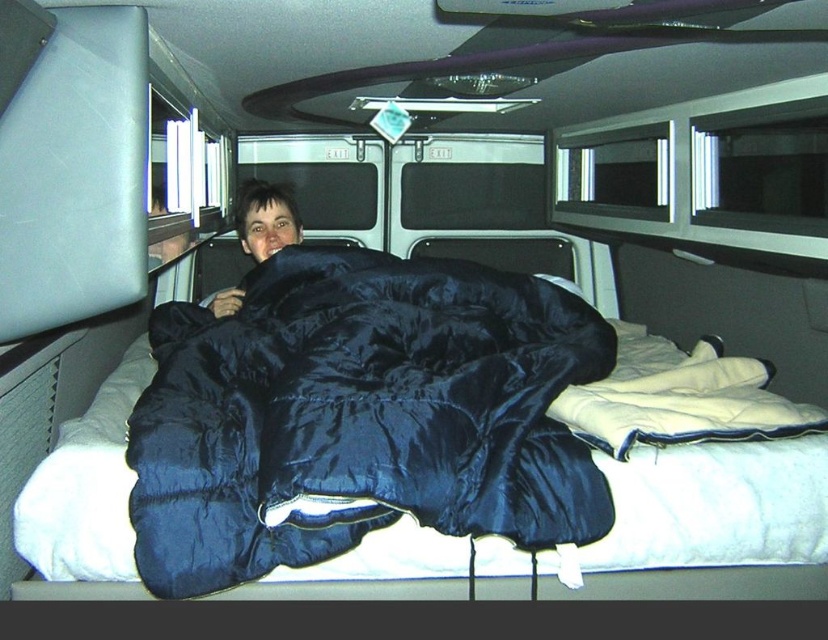
Is black silky sleeping bag at center further to camera compared to matte black sleeping bag at center?

No, black silky sleeping bag at center is closer to the viewer.

Is black silky sleeping bag at center taller than matte black sleeping bag at center?

Indeed, black silky sleeping bag at center has a greater height compared to matte black sleeping bag at center.

Who is more distant from viewer, (340,269) or (273,216)?

The point (273,216) is behind.

Locate an element on the screen. The image size is (828, 640). black silky sleeping bag at center is located at coordinates (360, 416).